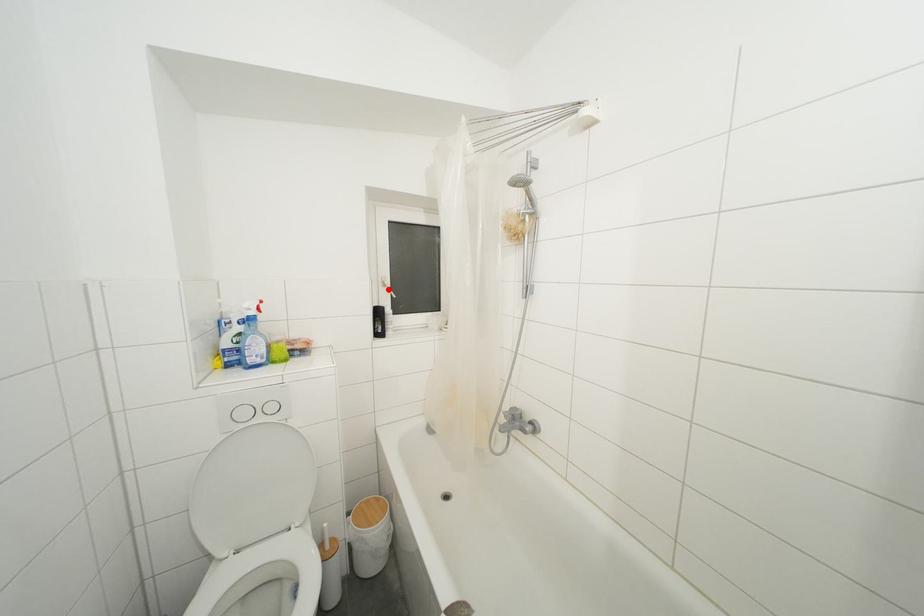
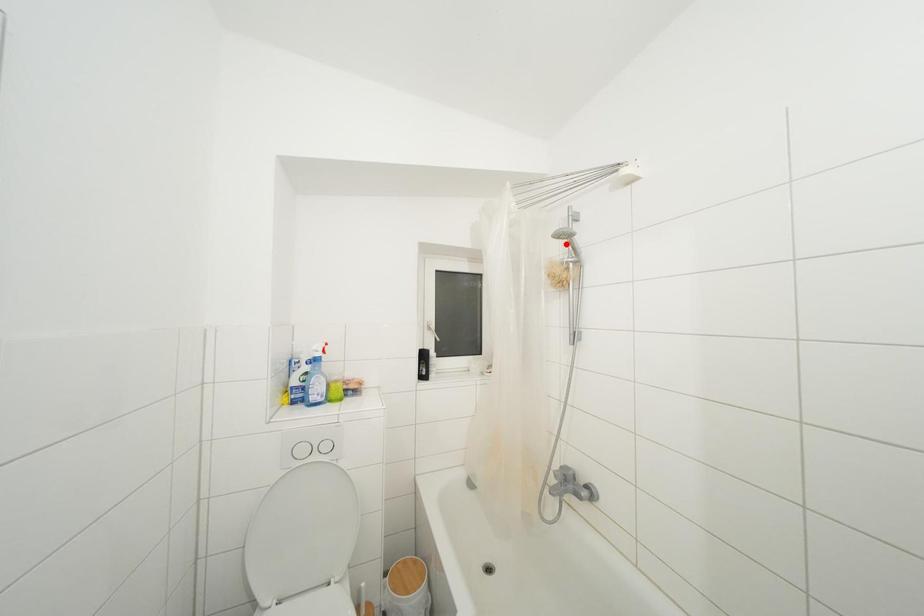
I am providing you with two images of the same scene from different viewpoints. A red point is marked on the first image and another point is marked on the second image. Is the marked point in image1 the same physical position as the marked point in image2?

No